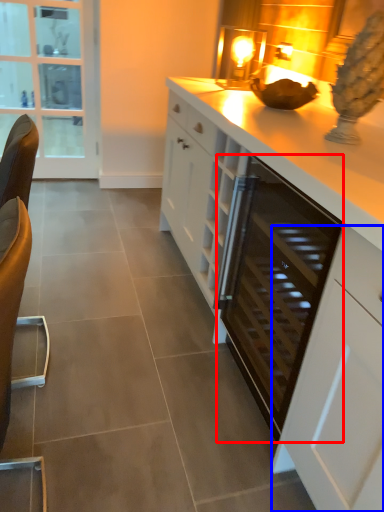
Question: Which of the following is the farthest to the observer, appliance (highlighted by a red box) or cabinetry (highlighted by a blue box)?

Choices:
 (A) appliance
 (B) cabinetry

Answer: (A)